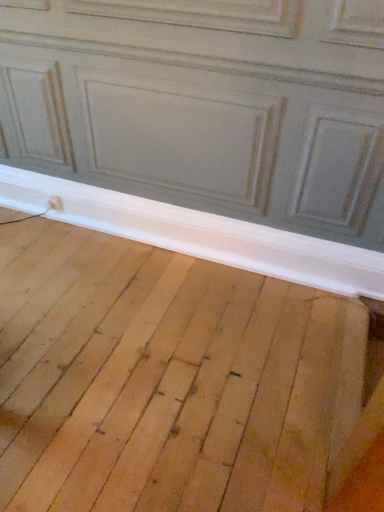
What do you see at coordinates (201, 234) in the screenshot? The height and width of the screenshot is (512, 384). I see `white wood baseboard at lower center` at bounding box center [201, 234].

In the scene shown: What is the approximate width of white wood baseboard at lower center?

white wood baseboard at lower center is 3.96 inches wide.

You are a GUI agent. You are given a task and a screenshot of the screen. Output one action in this format:
    pyautogui.click(x=<x>, y=<y>)
    Task: Click on the white wood baseboard at lower center
    The height and width of the screenshot is (512, 384).
    Given the screenshot: What is the action you would take?
    pyautogui.click(x=201, y=234)

This screenshot has height=512, width=384. I want to click on natural wood floor at lower center, so click(166, 379).

This screenshot has height=512, width=384. What do you see at coordinates (166, 379) in the screenshot?
I see `natural wood floor at lower center` at bounding box center [166, 379].

Where is `white wood baseboard at lower center`? white wood baseboard at lower center is located at coordinates (201, 234).

Considering the relative positions of natural wood floor at lower center and white wood baseboard at lower center in the image provided, is natural wood floor at lower center to the right of white wood baseboard at lower center from the viewer's perspective?

Incorrect, natural wood floor at lower center is not on the right side of white wood baseboard at lower center.

In the scene shown: Which object is more forward, natural wood floor at lower center or white wood baseboard at lower center?

natural wood floor at lower center.

Considering the points (65, 224) and (293, 265), which point is behind, point (65, 224) or point (293, 265)?

The point (65, 224) is farther from the camera.

From the image's perspective, between natural wood floor at lower center and white wood baseboard at lower center, which one is located above?

From the image's view, white wood baseboard at lower center is above.

From a real-world perspective, which is physically below, natural wood floor at lower center or white wood baseboard at lower center?

natural wood floor at lower center.

Does natural wood floor at lower center have a lesser width compared to white wood baseboard at lower center?

No.

Is natural wood floor at lower center shorter than white wood baseboard at lower center?

Correct, natural wood floor at lower center is not as tall as white wood baseboard at lower center.

Considering the relative sizes of natural wood floor at lower center and white wood baseboard at lower center in the image provided, is natural wood floor at lower center bigger than white wood baseboard at lower center?

Correct, natural wood floor at lower center is larger in size than white wood baseboard at lower center.

Choose the correct answer: Is natural wood floor at lower center inside white wood baseboard at lower center or outside it?

natural wood floor at lower center is outside white wood baseboard at lower center.

Is natural wood floor at lower center beside white wood baseboard at lower center?

No.

Is natural wood floor at lower center facing away from white wood baseboard at lower center?

No, natural wood floor at lower center's orientation is not away from white wood baseboard at lower center.

Where is `window sill above the natural wood floor at lower center (from a real-world perspective)`? The height and width of the screenshot is (512, 384). window sill above the natural wood floor at lower center (from a real-world perspective) is located at coordinates (201, 234).

Would you say white wood baseboard at lower center is to the left or to the right of natural wood floor at lower center in the picture?

In the image, white wood baseboard at lower center appears on the right side of natural wood floor at lower center.

Looking at this image, which object is more forward, white wood baseboard at lower center or natural wood floor at lower center?

Positioned in front is natural wood floor at lower center.

Is point (74, 219) more distant than point (195, 356)?

Yes, it is.

From the image's perspective, is white wood baseboard at lower center beneath natural wood floor at lower center?

No.

From a real-world perspective, which is physically below, white wood baseboard at lower center or natural wood floor at lower center?

natural wood floor at lower center, from a real-world perspective.

Considering the relative sizes of white wood baseboard at lower center and natural wood floor at lower center in the image provided, is white wood baseboard at lower center thinner than natural wood floor at lower center?

Yes, white wood baseboard at lower center is thinner than natural wood floor at lower center.

Is white wood baseboard at lower center shorter than natural wood floor at lower center?

In fact, white wood baseboard at lower center may be taller than natural wood floor at lower center.

Considering the relative sizes of white wood baseboard at lower center and natural wood floor at lower center in the image provided, is white wood baseboard at lower center bigger than natural wood floor at lower center?

Actually, white wood baseboard at lower center might be smaller than natural wood floor at lower center.

Is white wood baseboard at lower center situated inside natural wood floor at lower center or outside?

white wood baseboard at lower center is outside natural wood floor at lower center.

Is white wood baseboard at lower center next to natural wood floor at lower center?

No, white wood baseboard at lower center is not making contact with natural wood floor at lower center.

Does white wood baseboard at lower center turn towards natural wood floor at lower center?

Yes, white wood baseboard at lower center is turned towards natural wood floor at lower center.

Can you tell me how much white wood baseboard at lower center and natural wood floor at lower center differ in facing direction?

91.3 degrees separate the facing orientations of white wood baseboard at lower center and natural wood floor at lower center.

Identify the location of window sill above the natural wood floor at lower center (from a real-world perspective). The image size is (384, 512). (201, 234).

At what (x,y) coordinates should I click in order to perform the action: click on plywood that is below the white wood baseboard at lower center (from the image's perspective). Please return your answer as a coordinate pair (x, y). The image size is (384, 512). Looking at the image, I should click on (166, 379).

I want to click on plywood located in front of the white wood baseboard at lower center, so click(x=166, y=379).